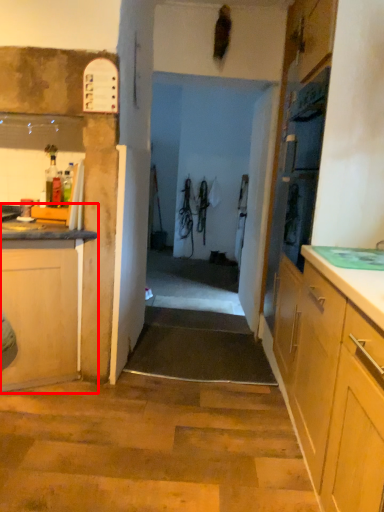
Question: Where is cabinetry (annotated by the red box) located in relation to door in the image?

Choices:
 (A) right
 (B) left

Answer: (B)